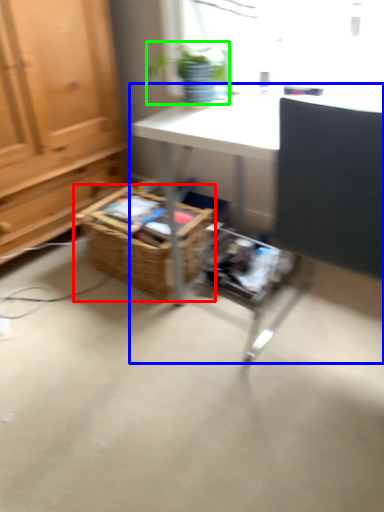
Question: Considering the real-world distances, which object is closest to basket (highlighted by a red box)? desk (highlighted by a blue box) or houseplant (highlighted by a green box).

Choices:
 (A) desk
 (B) houseplant

Answer: (A)